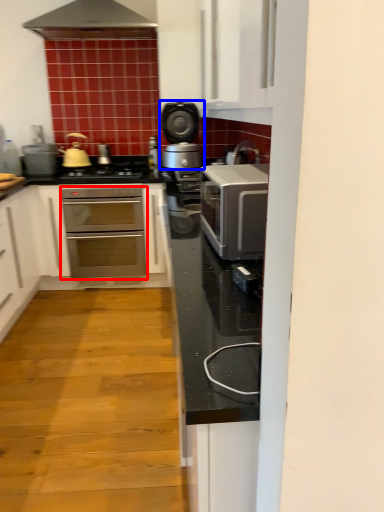
Question: Which object appears closest to the camera in this image, oven (highlighted by a red box) or home appliance (highlighted by a blue box)?

Choices:
 (A) oven
 (B) home appliance

Answer: (B)